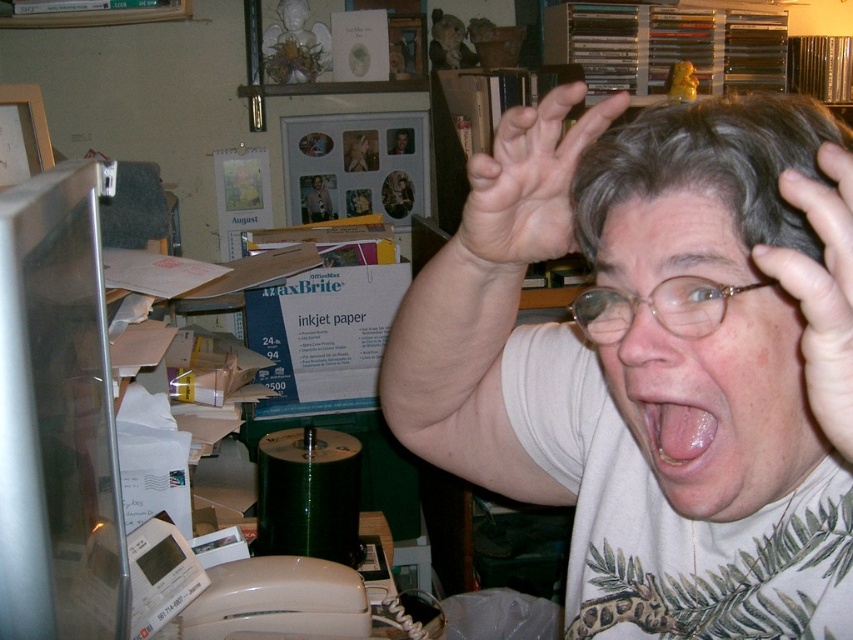
Question: Which of these objects is positioned farthest from the metallic silver monitor at left?

Choices:
 (A) glossy pink tongue at center
 (B) smooth skin hand at upper right
 (C) gold-framed glasses at center
 (D) white matte shirt at center

Answer: (B)

Question: Which object is the farthest from the smooth skin hand at upper right?

Choices:
 (A) white matte shirt at center
 (B) metallic silver monitor at left
 (C) gold-framed glasses at center

Answer: (B)

Question: Is gray matte hand at upper center above gold-framed glasses at center?

Choices:
 (A) yes
 (B) no

Answer: (A)

Question: Which object is farther from the camera taking this photo?

Choices:
 (A) metallic silver monitor at left
 (B) gold-framed glasses at center

Answer: (B)

Question: Is gray hair at center to the right of smooth skin hand at upper right from the viewer's perspective?

Choices:
 (A) no
 (B) yes

Answer: (A)

Question: Can you confirm if metallic silver monitor at left is bigger than smooth skin hand at upper right?

Choices:
 (A) no
 (B) yes

Answer: (B)